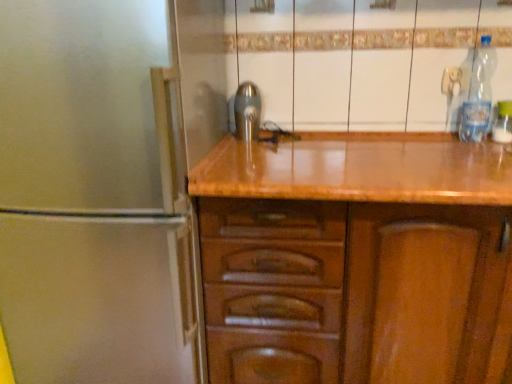
Question: Is clear plastic bottle at right, the 2th bottle positioned from the left, outside of polished metallic tap at center?

Choices:
 (A) no
 (B) yes

Answer: (B)

Question: Considering the relative positions of clear plastic bottle at right, which is counted as the 1th bottle, starting from the right, and polished metallic tap at center in the image provided, is clear plastic bottle at right, which is counted as the 1th bottle, starting from the right, behind polished metallic tap at center?

Choices:
 (A) yes
 (B) no

Answer: (B)

Question: Are clear plastic bottle at right, the 2th bottle positioned from the left, and polished metallic tap at center far apart?

Choices:
 (A) yes
 (B) no

Answer: (B)

Question: Is clear plastic bottle at right, the 2th bottle positioned from the left, to the left of polished metallic tap at center from the viewer's perspective?

Choices:
 (A) no
 (B) yes

Answer: (A)

Question: Is clear plastic bottle at right, the 2th bottle positioned from the left, turned away from polished metallic tap at center?

Choices:
 (A) yes
 (B) no

Answer: (B)

Question: Can you confirm if clear plastic bottle at right, the 2th bottle positioned from the left, is thinner than polished metallic tap at center?

Choices:
 (A) yes
 (B) no

Answer: (A)

Question: From the image's perspective, does clear plastic bottle at upper right, which ranks as the 1th bottle in left-to-right order, appear lower than clear plastic bottle at right, which is counted as the 1th bottle, starting from the right?

Choices:
 (A) no
 (B) yes

Answer: (A)

Question: Can you confirm if clear plastic bottle at upper right, which ranks as the 1th bottle in left-to-right order, is thinner than clear plastic bottle at right, which is counted as the 1th bottle, starting from the right?

Choices:
 (A) no
 (B) yes

Answer: (A)

Question: Does clear plastic bottle at upper right, which ranks as the 1th bottle in left-to-right order, have a greater width compared to clear plastic bottle at right, which is counted as the 1th bottle, starting from the right?

Choices:
 (A) no
 (B) yes

Answer: (B)

Question: From the image's perspective, is clear plastic bottle at upper right, which ranks as the 1th bottle in left-to-right order, located above clear plastic bottle at right, the 2th bottle positioned from the left?

Choices:
 (A) no
 (B) yes

Answer: (B)

Question: Would you say clear plastic bottle at right, the 2th bottle positioned from the left, is part of clear plastic bottle at upper right, which ranks as the 1th bottle in left-to-right order,'s contents?

Choices:
 (A) yes
 (B) no

Answer: (B)

Question: From a real-world perspective, is clear plastic bottle at upper right, which ranks as the 1th bottle in left-to-right order, on top of clear plastic bottle at right, the 2th bottle positioned from the left?

Choices:
 (A) no
 (B) yes

Answer: (B)

Question: Is polished metallic tap at center thinner than clear plastic bottle at upper right, the second bottle from the right?

Choices:
 (A) no
 (B) yes

Answer: (B)